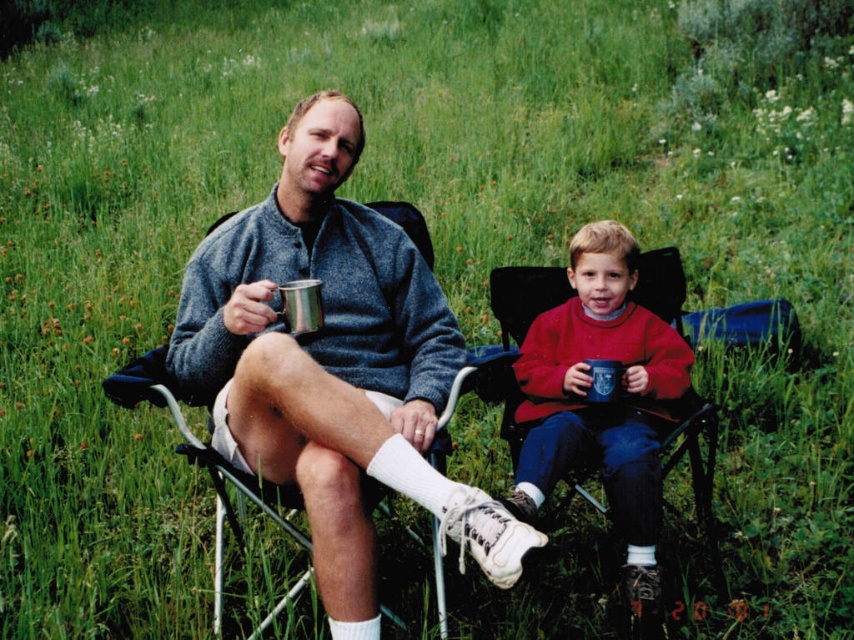
You are a photographer standing in front of the scene and want to take a photo of the matte red sweater at center and the metallic folding chair at center. Which object will appear closer to you in the photo?

The matte red sweater at center will appear closer to you in the photo because it is positioned further to the viewer than the metallic folding chair at center.

You are standing at the origin point of the coordinate system in the image. You want to hand a gift to the person wearing the matte red sweater at center. Which direction should you move to reach their location?

The matte red sweater at center is located at coordinate point (601, 400), so you should move northeast to reach their location.